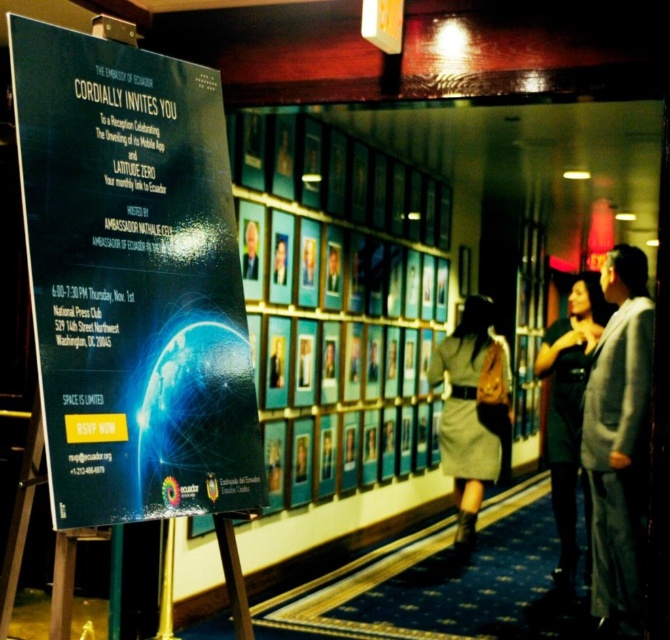
Question: Which object is farther from the camera taking this photo?

Choices:
 (A) gray wool coat at right
 (B) matte black poster at center

Answer: (A)

Question: Is matte black poster at center thinner than black dress at center?

Choices:
 (A) no
 (B) yes

Answer: (A)

Question: Can you confirm if matte black poster at center is positioned to the right of gray wool coat at right?

Choices:
 (A) yes
 (B) no

Answer: (B)

Question: Can you confirm if gray wool coat at right is positioned above black dress at center?

Choices:
 (A) yes
 (B) no

Answer: (B)

Question: Estimate the real-world distances between objects in this image. Which object is closer to the matte black poster at center?

Choices:
 (A) black dress at center
 (B) gray wool coat at right

Answer: (A)

Question: Which object is closer to the camera taking this photo?

Choices:
 (A) gray wool coat at right
 (B) black dress at center
 (C) light brown fabric skirt at center
 (D) matte black poster at center

Answer: (D)